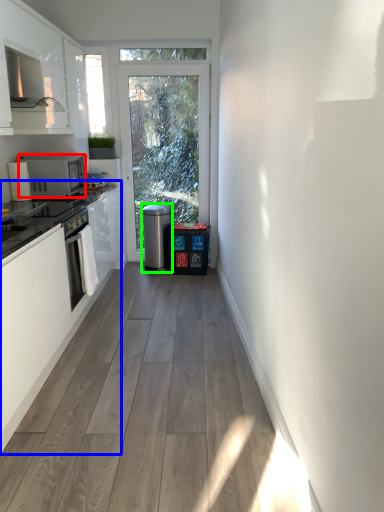
Question: Which object is positioned farthest from kitchen appliance (highlighted by a red box)? Select from cabinetry (highlighted by a blue box) and water heater (highlighted by a green box).

Choices:
 (A) cabinetry
 (B) water heater

Answer: (B)